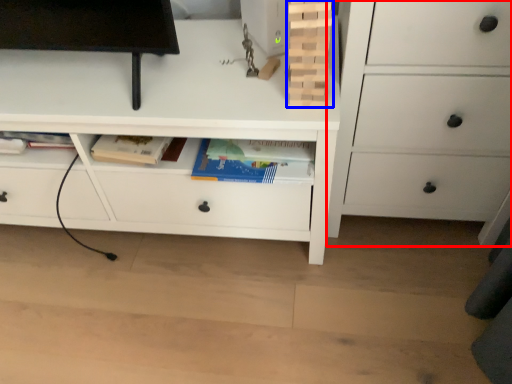
Question: Among these objects, which one is farthest to the camera, chest of drawers (highlighted by a red box) or book (highlighted by a blue box)?

Choices:
 (A) chest of drawers
 (B) book

Answer: (B)